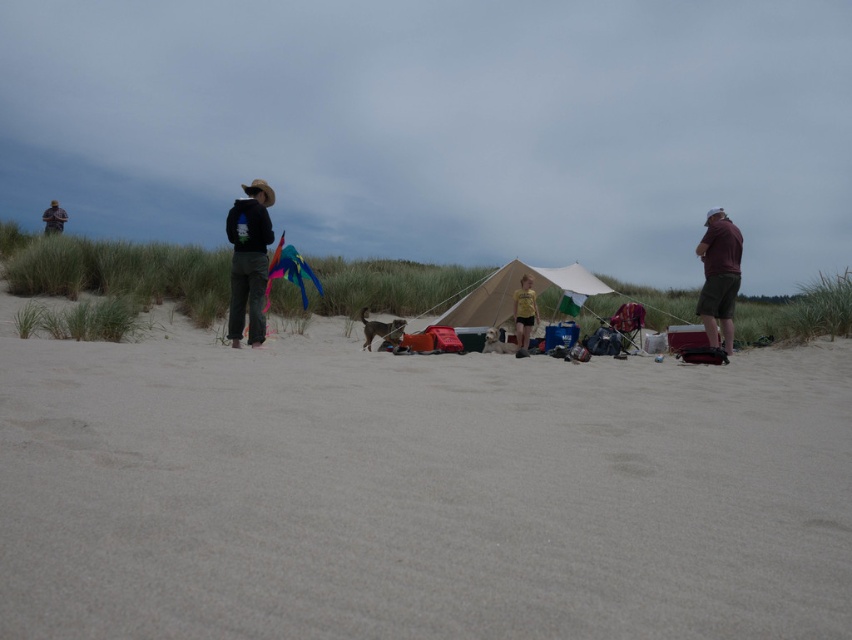
Question: Can you confirm if beige canvas tent at center is thinner than camouflage jacket at left?

Choices:
 (A) yes
 (B) no

Answer: (A)

Question: Can you confirm if smooth sand at center is positioned to the right of maroon fabric shirt at right?

Choices:
 (A) no
 (B) yes

Answer: (A)

Question: Among these points, which one is farthest from the camera?

Choices:
 (A) (717, 246)
 (B) (527, 336)

Answer: (B)

Question: Which object is positioned closest to the camouflage jacket at left?

Choices:
 (A) beige canvas tent at center
 (B) maroon fabric shirt at right
 (C) smooth sand at center
 (D) yellow t-shirt at center

Answer: (D)

Question: Which point is farther to the camera?

Choices:
 (A) (232, 218)
 (B) (645, 420)
 (C) (502, 280)
 (D) (703, 323)

Answer: (C)

Question: Can you confirm if beige canvas tent at center is positioned above camouflage jacket at left?

Choices:
 (A) yes
 (B) no

Answer: (B)